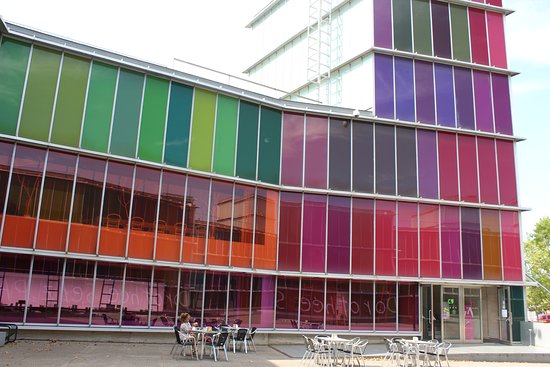
Identify the location of doors. (450, 322), (473, 315), (506, 329).